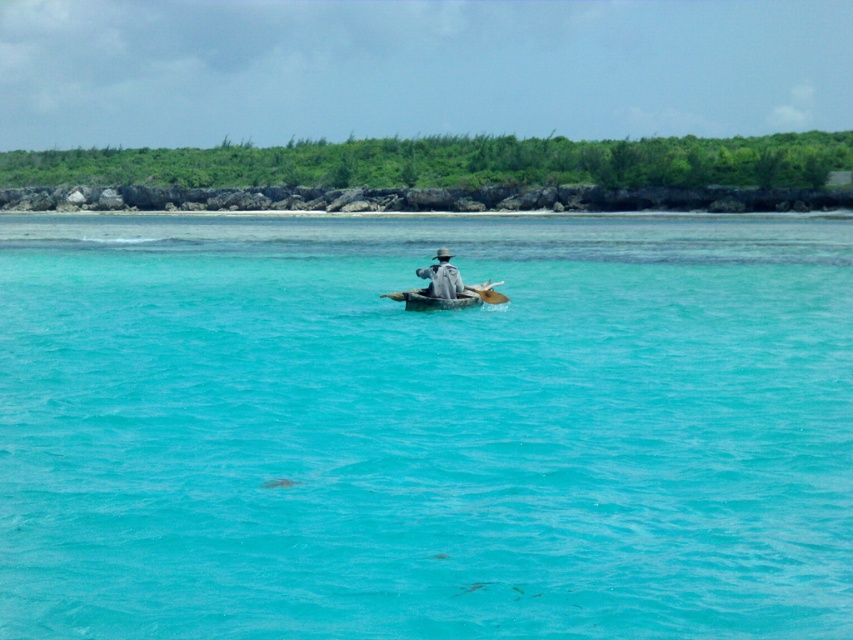
Question: Which of the following is the closest to the observer?

Choices:
 (A) (440, 296)
 (B) (488, 292)

Answer: (A)

Question: Can you confirm if gray fabric hat at center is thinner than wooden paddle at center?

Choices:
 (A) yes
 (B) no

Answer: (B)

Question: Which point appears farthest from the camera in this image?

Choices:
 (A) (496, 296)
 (B) (445, 292)
 (C) (181, 636)

Answer: (A)

Question: Which object is the closest to the gray fabric hat at center?

Choices:
 (A) turquoise water at center
 (B) wooden paddle at center

Answer: (B)

Question: In this image, where is turquoise water at center located relative to wooden paddle at center?

Choices:
 (A) below
 (B) above

Answer: (B)

Question: Is turquoise water at center bigger than gray fabric hat at center?

Choices:
 (A) yes
 (B) no

Answer: (A)